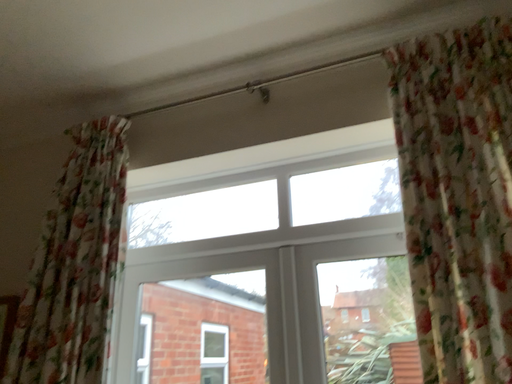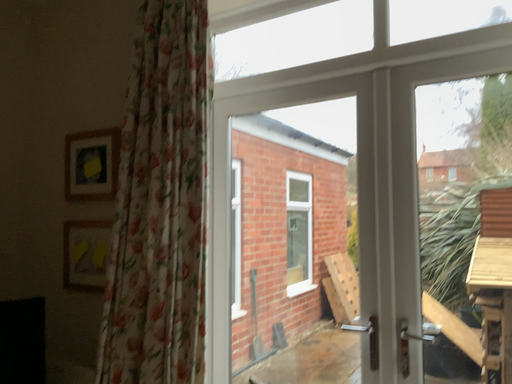
Question: How did the camera likely rotate when shooting the video?

Choices:
 (A) rotated right
 (B) rotated left

Answer: (B)